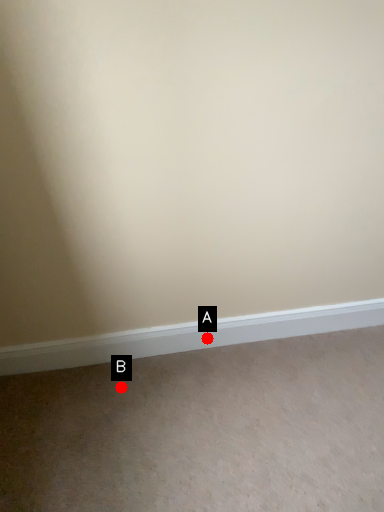
Question: Two points are circled on the image, labeled by A and B beside each circle. Which point is closer to the camera taking this photo?

Choices:
 (A) A is closer
 (B) B is closer

Answer: (B)